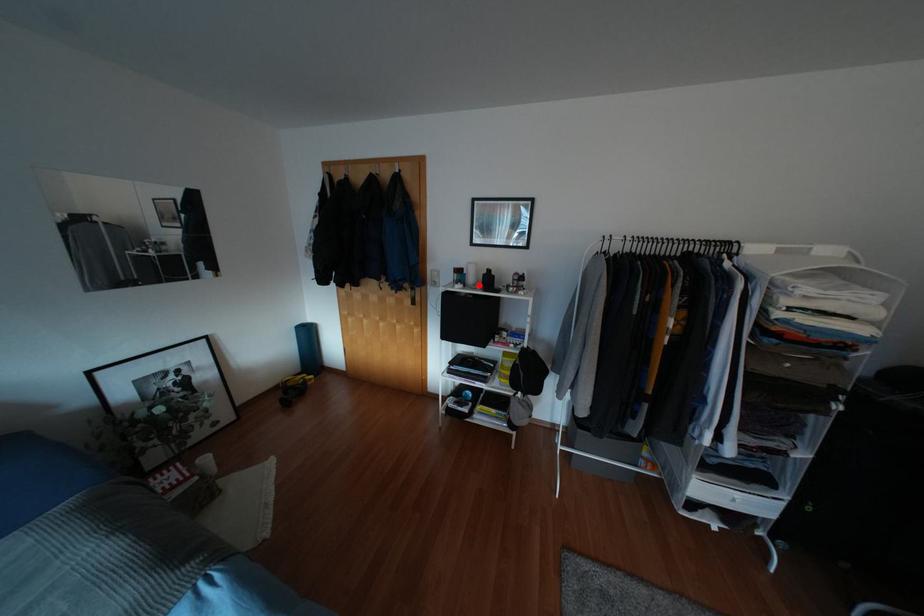
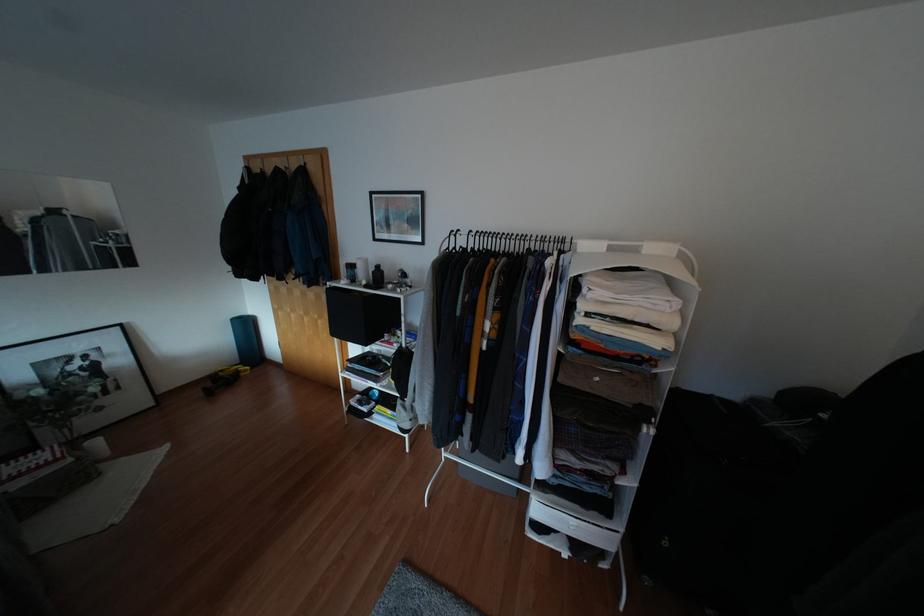
Find the pixel in the second image that matches the highlighted location in the first image.

(362, 282)